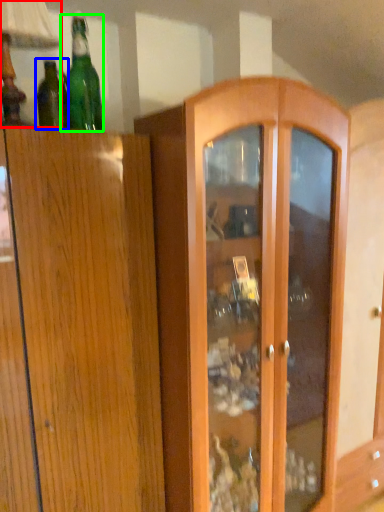
Question: Based on their relative distances, which object is farther from table lamp (highlighted by a red box)? Choose from bottle (highlighted by a blue box) and bottle (highlighted by a green box).

Choices:
 (A) bottle
 (B) bottle

Answer: (A)